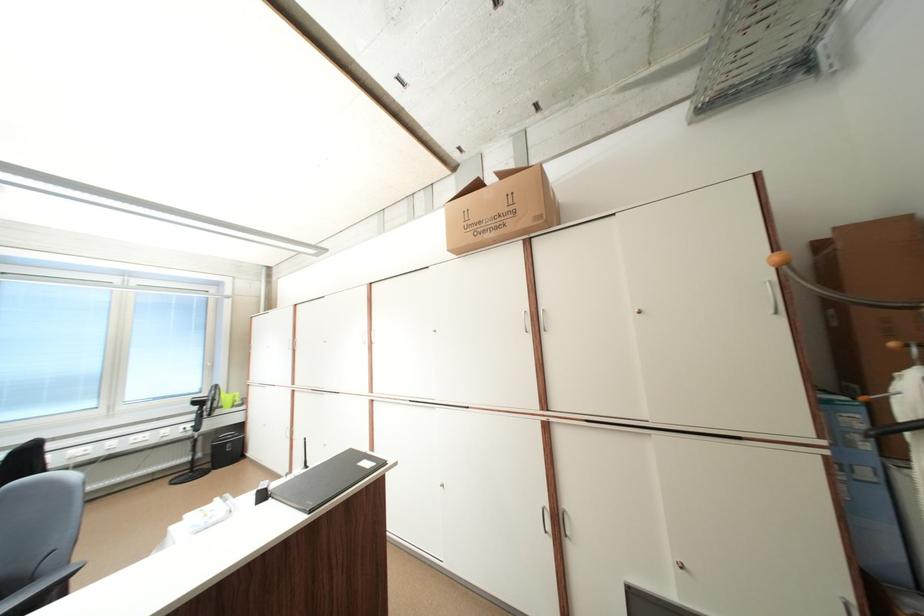
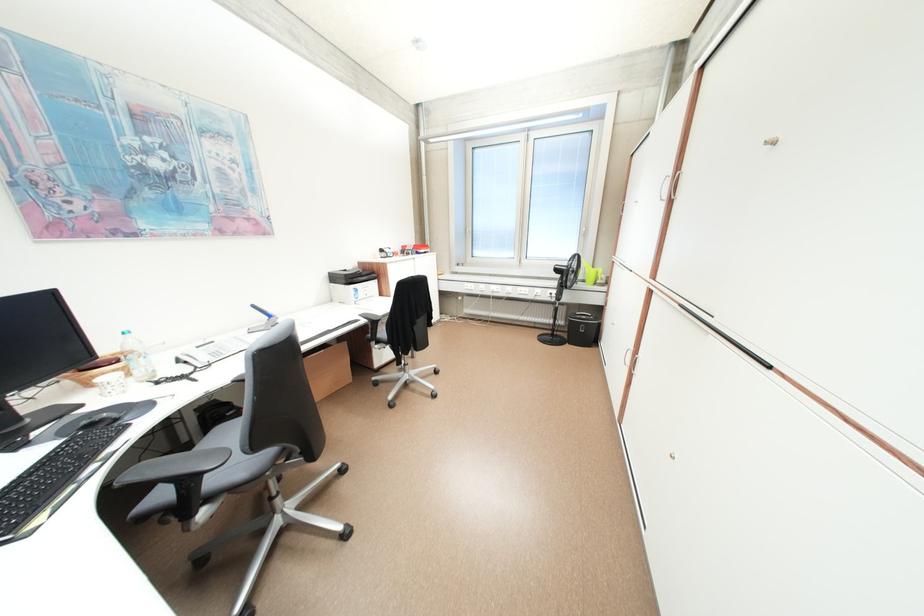
Find the pixel in the second image that matches the point at 216,466 in the first image.

(576, 337)